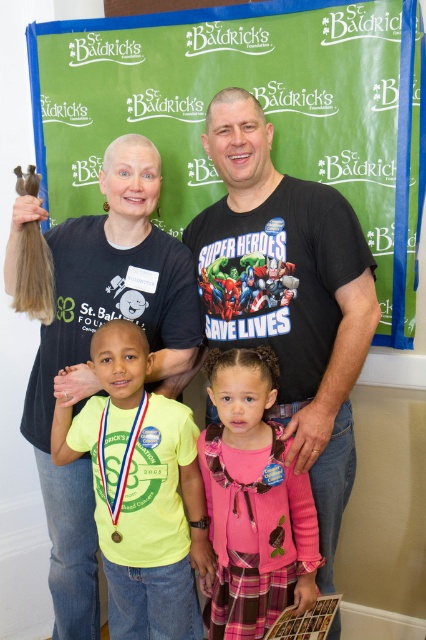
Question: Which object is closer to the camera taking this photo?

Choices:
 (A) matte yellow shirt at center
 (B) gold metallic medal at center
 (C) wooden plaque at center

Answer: (A)

Question: Is matte brown hair at upper left bigger than gold metallic medal at center?

Choices:
 (A) no
 (B) yes

Answer: (B)

Question: Is wooden plaque at center to the left of matte yellow shirt at center from the viewer's perspective?

Choices:
 (A) no
 (B) yes

Answer: (A)

Question: From the image, what is the correct spatial relationship of matte brown hair at upper left in relation to pink fabric dress at center?

Choices:
 (A) below
 (B) above

Answer: (B)

Question: Which point is closer to the camera taking this photo?

Choices:
 (A) (55, 176)
 (B) (253, 513)
 (C) (115, 532)
 (D) (120, 593)

Answer: (B)

Question: Which point is closer to the camera?

Choices:
 (A) (161, 237)
 (B) (252, 362)
 (C) (313, 132)

Answer: (B)